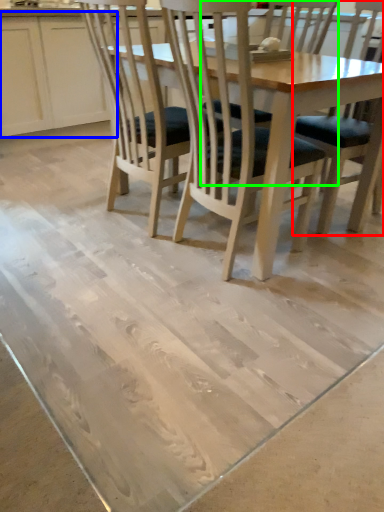
Question: Which object is the closest to the chair (highlighted by a red box)? Choose among these: cabinetry (highlighted by a blue box) or chair (highlighted by a green box).

Choices:
 (A) cabinetry
 (B) chair

Answer: (B)